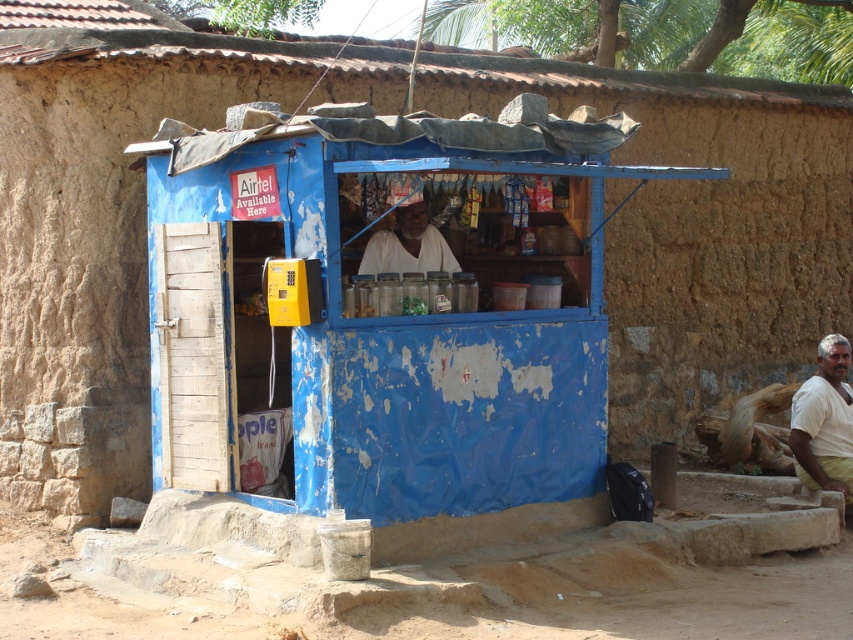
You are a customer entering the shop and see the white cotton shirt at lower right and the white matte man at center. Which object is narrower?

The white cotton shirt at lower right is narrower than the white matte man at center.

You are a customer entering the shop and see the white cotton shirt at lower right and the white matte man at center. Which object is taller?

The white cotton shirt at lower right is much taller than the white matte man at center.

You are a customer entering the shop and see the white cotton shirt at lower right and the white matte man at center. Which object is closer to the entrance?

The white cotton shirt at lower right is closer to the entrance because it is located below the white matte man at center, who is positioned further inside the shop.